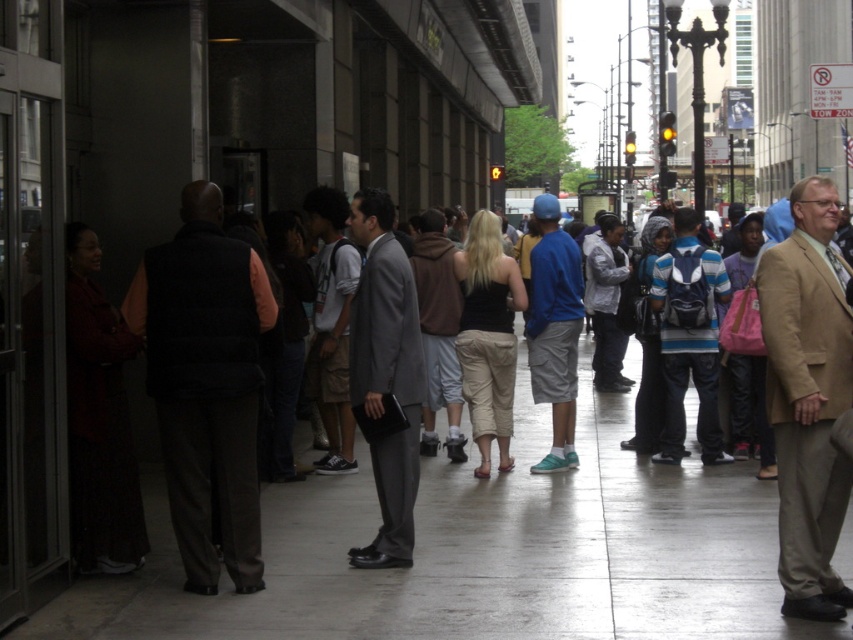
Based on the photo, can you confirm if gray suit at center is positioned above blue cotton shirt at center?

Yes.

Is point (412, 401) closer to camera compared to point (531, 252)?

That is True.

At what (x,y) coordinates should I click in order to perform the action: click on gray suit at center. Please return your answer as a coordinate pair (x, y). Looking at the image, I should click on (386, 376).

The height and width of the screenshot is (640, 853). I want to click on gray suit at center, so click(386, 376).

Does gray suit at center have a larger size compared to striped knit sweater at center?

No, gray suit at center is not bigger than striped knit sweater at center.

Who is positioned more to the right, gray suit at center or striped knit sweater at center?

From the viewer's perspective, striped knit sweater at center appears more on the right side.

Which is behind, point (405, 461) or point (704, 276)?

The point (704, 276) is behind.

This screenshot has height=640, width=853. What are the coordinates of `gray suit at center` in the screenshot? It's located at (386, 376).

Is point (776, 282) farther from camera compared to point (374, 554)?

That is False.

Does tan fabric suit at right have a greater height compared to gray suit at center?

No, tan fabric suit at right is not taller than gray suit at center.

Is point (790, 369) positioned in front of point (370, 212)?

Yes, point (790, 369) is in front of point (370, 212).

Identify the location of tan fabric suit at right. (808, 396).